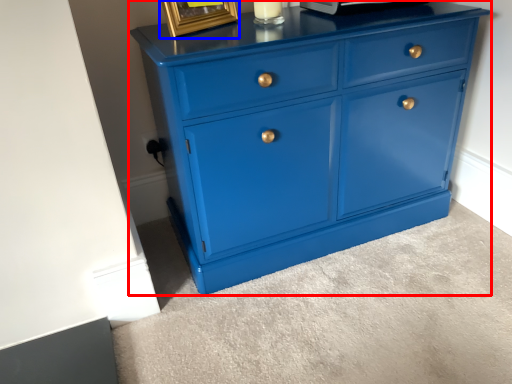
Question: Which of the following is the farthest to the observer, chest of drawers (highlighted by a red box) or picture frame (highlighted by a blue box)?

Choices:
 (A) chest of drawers
 (B) picture frame

Answer: (B)